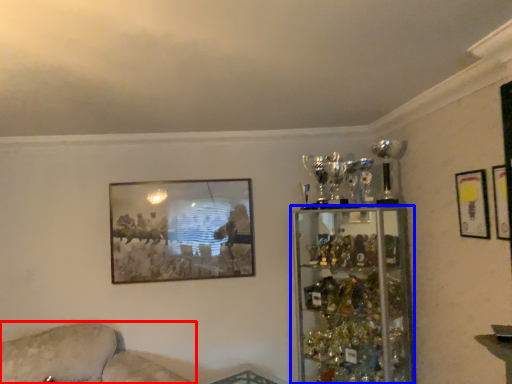
Question: Among these objects, which one is nearest to the camera, couch (highlighted by a red box) or shelf (highlighted by a blue box)?

Choices:
 (A) couch
 (B) shelf

Answer: (A)